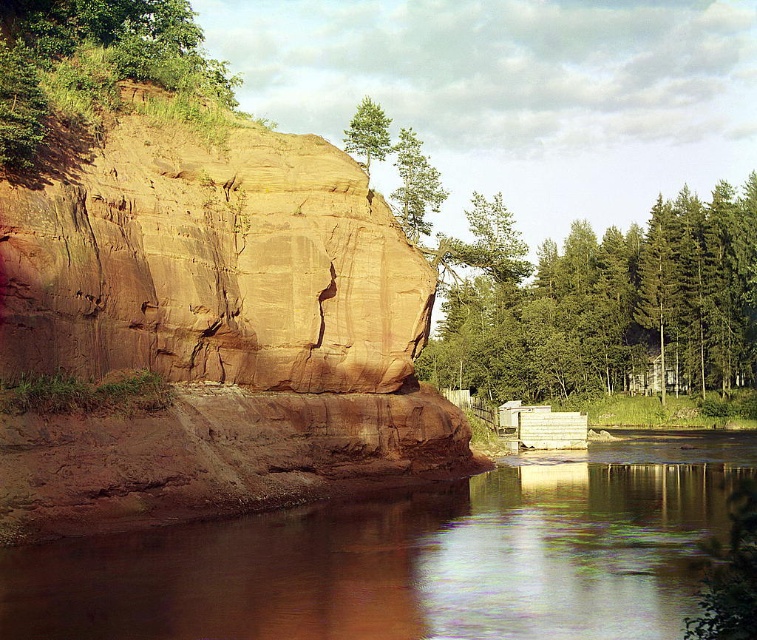
You are a hiker standing at the base of the brown rough rock face at upper left and want to reach the green leafy tree at upper center. The path between them is straight. If your maximum comfortable walking distance is 25 meters, can you comfortably walk to the tree without needing a break?

The brown rough rock face at upper left is 24.71 meters from the green leafy tree at upper center. Since 24.71 meters is just under your 25 meter limit, you can comfortably walk to the tree without needing a break.

You are an observer looking at the scene. There are two green trees at the upper center of the image. Which one is closer to you, the green matte tree at upper center or the green leafy tree at upper center?

The green matte tree at upper center is closer to you because the green leafy tree at upper center is positioned behind it.